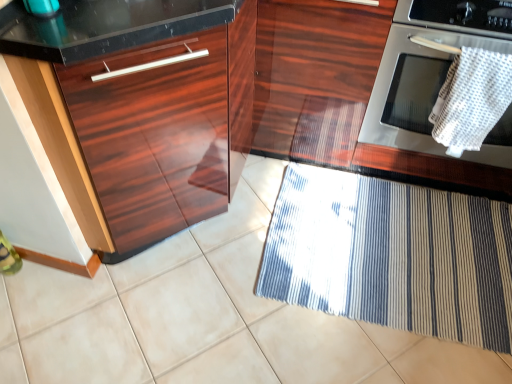
This screenshot has height=384, width=512. I want to click on vacant area that lies in front of glossy wood drawer at left, so click(156, 334).